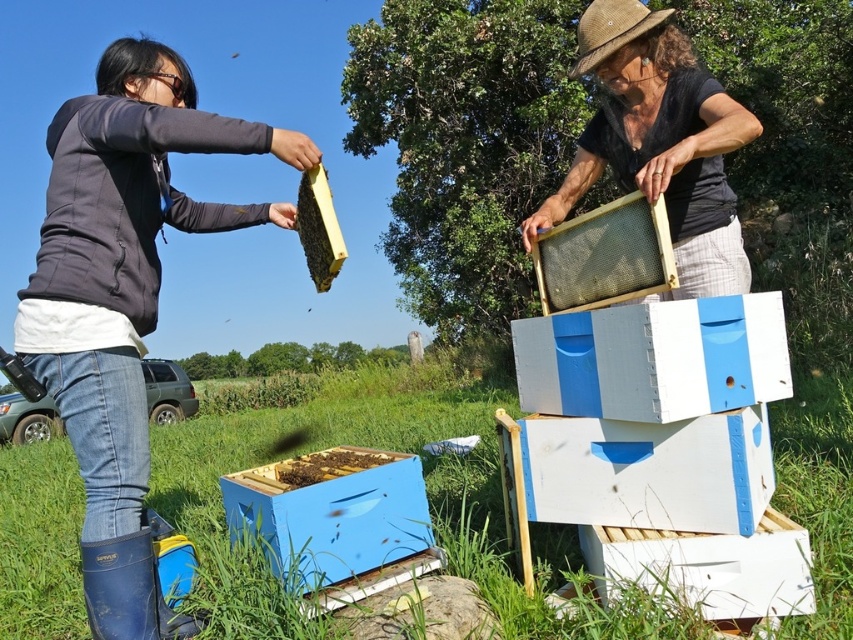
You are a beekeeper who needs to store the matte black frame at center and the blue painted wooden beehive at lower center in a storage shed. The shed has a height limit of 1.5 meters. Can both items be stored vertically without exceeding the height limit?

The matte black frame at center is much taller than the blue painted wooden beehive at lower center. If the blue painted wooden beehive at lower center is under 1.5 meters, then the matte black frame at center may exceed the height limit. However, without specific measurements, it is uncertain whether both can fit vertically.